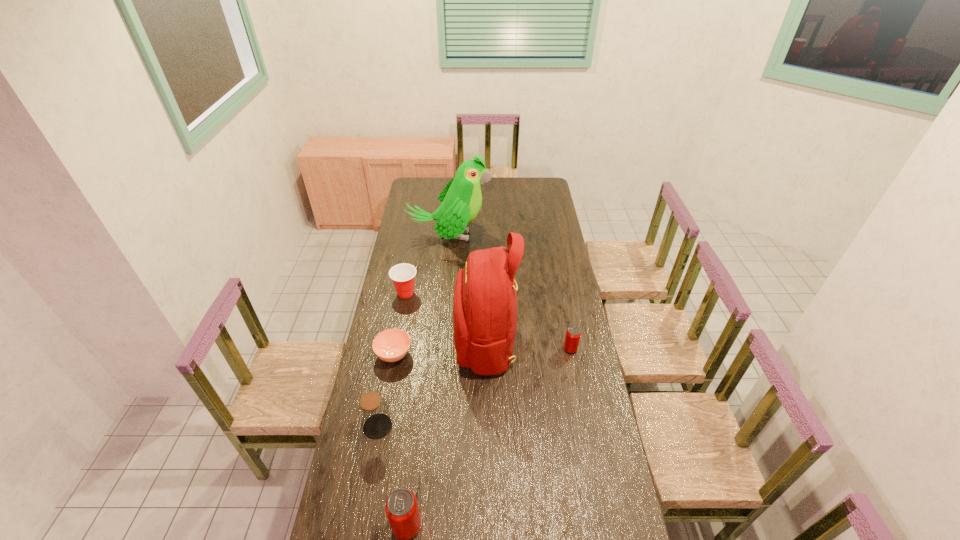
This screenshot has height=540, width=960. Find the location of `the shorter can`. the shorter can is located at coordinates (573, 333).

This screenshot has height=540, width=960. Identify the location of the rightmost object. (573, 333).

Find the location of a particular element. the farthest object is located at coordinates (461, 199).

This screenshot has width=960, height=540. Find the location of `backpack`. backpack is located at coordinates (485, 296).

The height and width of the screenshot is (540, 960). Identify the location of soup bowl. (391, 345).

This screenshot has width=960, height=540. I want to click on the sixth farthest object, so click(x=373, y=412).

Identify the location of cup. (403, 275).

I want to click on vacant point located on the back of the right can, so 564,316.

Where is `free space located 0.270m on the beak of the farthest object`? The image size is (960, 540). free space located 0.270m on the beak of the farthest object is located at coordinates (539, 237).

At what (x,y) coordinates should I click in order to perform the action: click on free space located on the front-facing side of the backpack. Please return your answer as a coordinate pair (x, y). The height and width of the screenshot is (540, 960). Looking at the image, I should click on click(x=409, y=340).